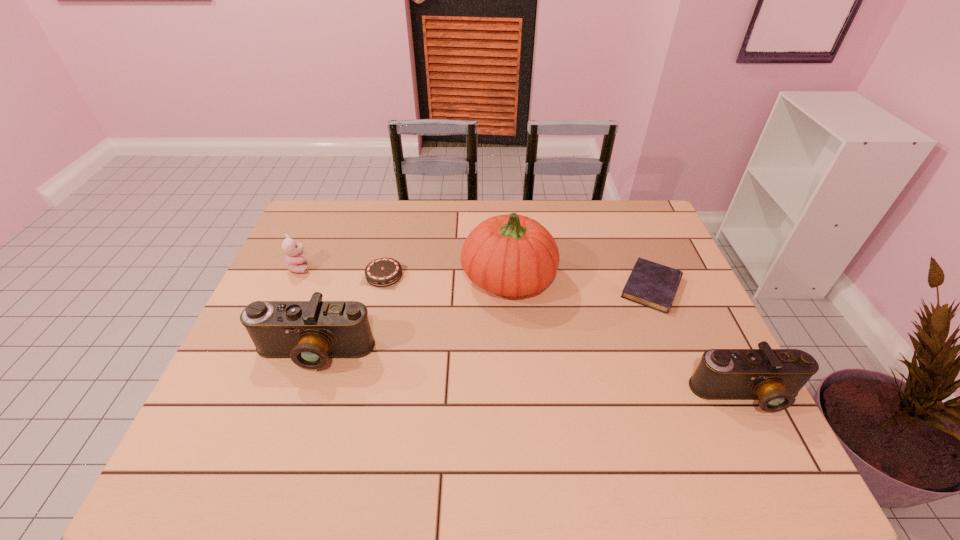
The image size is (960, 540). I want to click on free space at the near edge of the desktop, so click(619, 426).

Locate an element on the screen. vacant space at the right edge is located at coordinates click(x=655, y=345).

Identify the location of vacant region at the far left corner of the desktop. (351, 217).

In the image, there is a desktop. Where is `blank space at the near left corner`? blank space at the near left corner is located at coordinates (228, 402).

The image size is (960, 540). Identify the location of vacant space at the far right corner of the desktop. (626, 220).

This screenshot has width=960, height=540. Find the location of `vacant area between the left camera and the shortest object`. vacant area between the left camera and the shortest object is located at coordinates (483, 320).

Locate an element on the screen. free space that is in between the taller camera and the right camera is located at coordinates (530, 374).

You are a GUI agent. You are given a task and a screenshot of the screen. Output one action in this format:
    pyautogui.click(x=<x>, y=<y>)
    Task: Click on the vacant region between the right camera and the teddy bear
    
    Given the screenshot: What is the action you would take?
    pyautogui.click(x=523, y=331)

Locate an element on the screen. This screenshot has height=540, width=960. free space between the shorter camera and the pumpkin is located at coordinates (627, 336).

This screenshot has height=540, width=960. What are the coordinates of `vacant point located between the right camera and the pumpkin` in the screenshot? It's located at (627, 336).